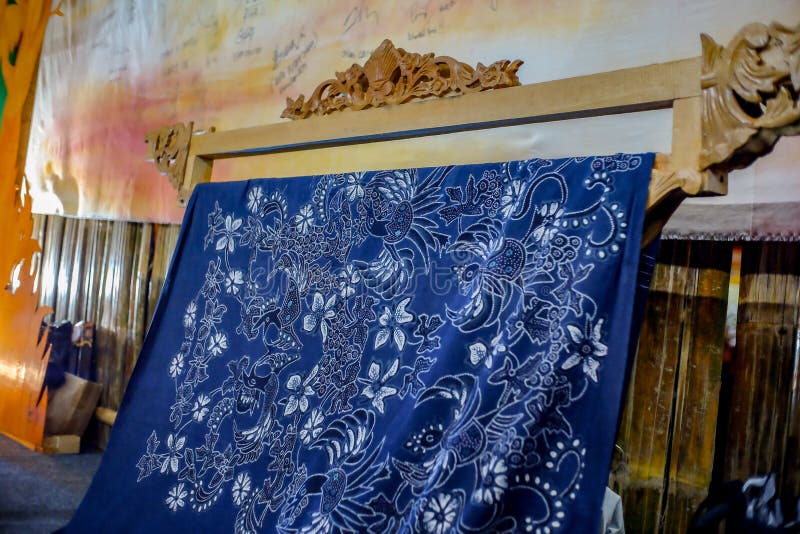
Locate an element on the screen. wall is located at coordinates (125, 103).